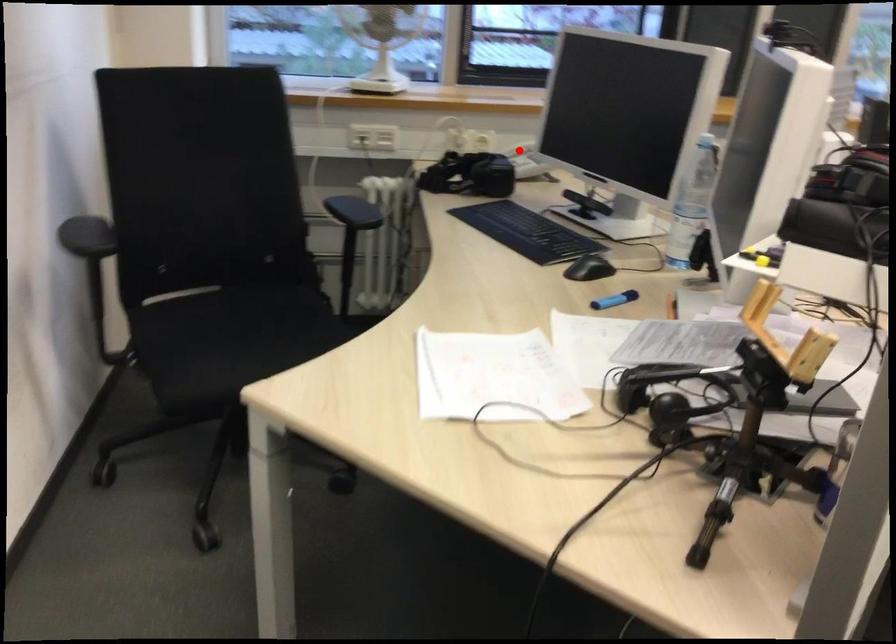
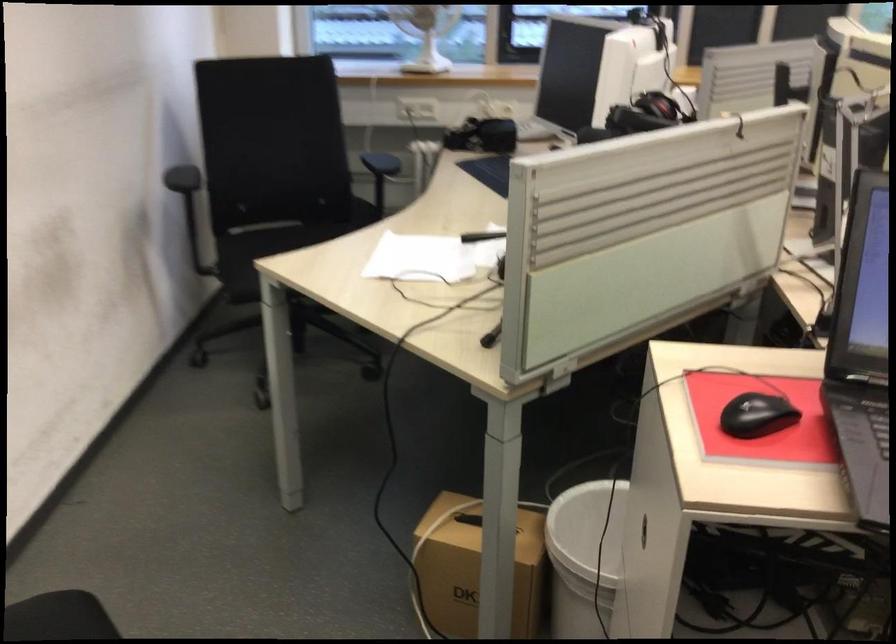
Question: I am providing you with two images of the same scene from different viewpoints. A red point is marked on the first image. At the location where the point appears in image 1, is it still visible in image 2?

Choices:
 (A) Yes
 (B) No

Answer: (B)